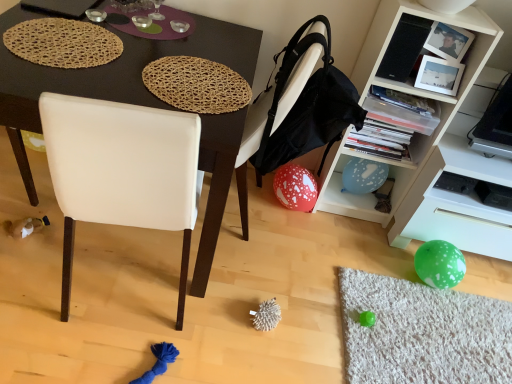
The width and height of the screenshot is (512, 384). In order to click on vacant area that lies between white plastic shelf at lower right and white matte cabinet at upper right in this screenshot , I will do `click(371, 234)`.